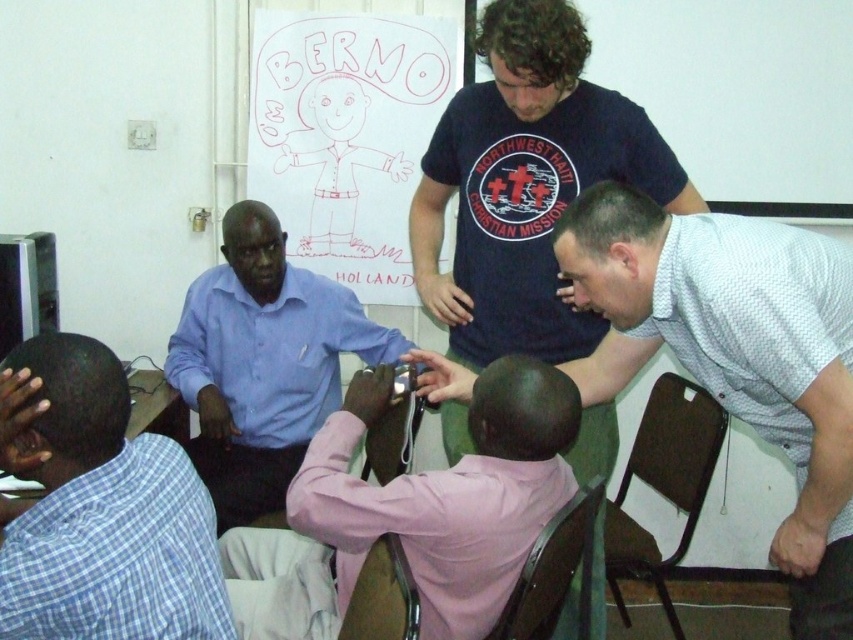
Does blue checkered shirt at lower left lie behind blue shirt at center?

That is False.

Does blue checkered shirt at lower left appear on the right side of blue shirt at center?

In fact, blue checkered shirt at lower left is to the left of blue shirt at center.

This screenshot has width=853, height=640. What are the coordinates of `blue checkered shirt at lower left` in the screenshot? It's located at (99, 508).

Can you confirm if blue checkered shirt at lower left is positioned to the left of pink fabric shirt at center?

Yes, blue checkered shirt at lower left is to the left of pink fabric shirt at center.

What are the coordinates of `blue checkered shirt at lower left` in the screenshot? It's located at (99, 508).

Identify the location of blue checkered shirt at lower left. 99,508.

Which is more to the right, pink fabric shirt at center or brown wooden chair at lower center?

Positioned to the right is brown wooden chair at lower center.

Who is more forward, [555,380] or [531,568]?

Point [555,380] is in front.

Where is `pink fabric shirt at center`? The image size is (853, 640). pink fabric shirt at center is located at coordinates (447, 493).